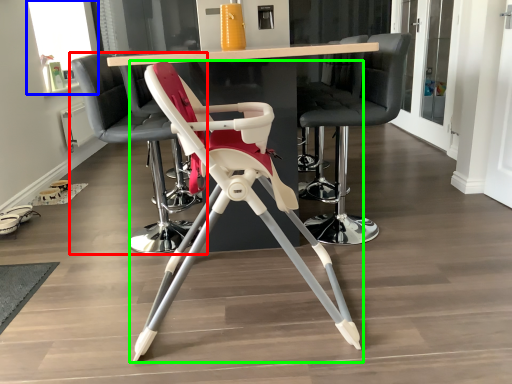
Question: Which object is positioned closest to chair (highlighted by a red box)? Select from window screen (highlighted by a blue box) and chair (highlighted by a green box).

Choices:
 (A) window screen
 (B) chair

Answer: (B)